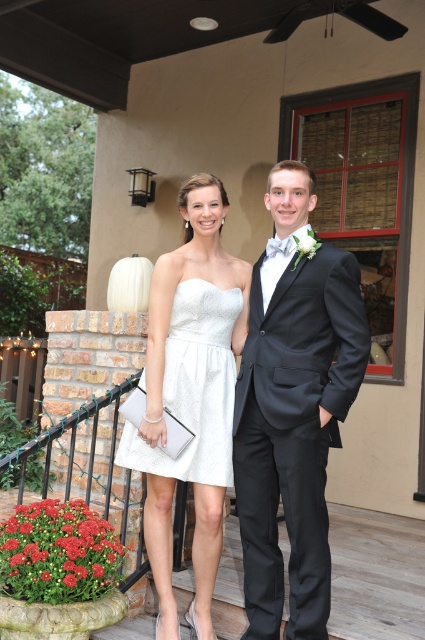
Question: From the image, what is the correct spatial relationship of shiny black suit at center in relation to white lace dress at center?

Choices:
 (A) left
 (B) right

Answer: (B)

Question: Can you confirm if shiny black suit at center is positioned to the left of satin white dress at center?

Choices:
 (A) yes
 (B) no

Answer: (B)

Question: Which point is closer to the camera taking this photo?

Choices:
 (A) (155, 512)
 (B) (144, 388)
 (C) (254, 497)

Answer: (C)

Question: Estimate the real-world distances between objects in this image. Which object is farther from the white lace dress at center?

Choices:
 (A) satin white dress at center
 (B) shiny black suit at center

Answer: (B)

Question: Does shiny black suit at center appear under white lace dress at center?

Choices:
 (A) no
 (B) yes

Answer: (B)

Question: Which point is closer to the camera taking this photo?

Choices:
 (A) (209, 369)
 (B) (206, 620)

Answer: (A)